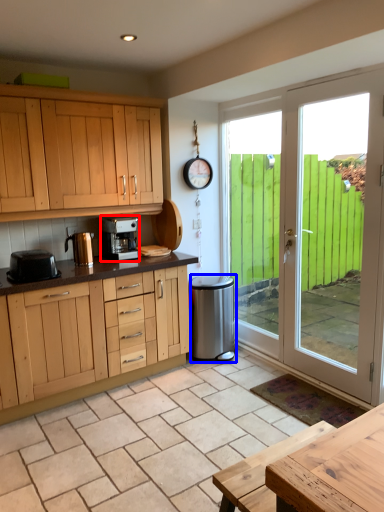
Question: Which object appears closest to the camera in this image, kitchen appliance (highlighted by a red box) or appliance (highlighted by a blue box)?

Choices:
 (A) kitchen appliance
 (B) appliance

Answer: (A)